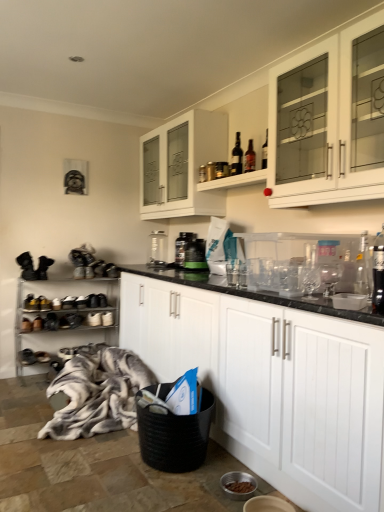
Question: Is dark glass bottle at upper center, the 1th bottle when ordered from left to right, facing away from black suede shoe at lower left?

Choices:
 (A) yes
 (B) no

Answer: (B)

Question: From a real-world perspective, is dark glass bottle at upper center, the 1th bottle when ordered from left to right, physically above black suede shoe at lower left?

Choices:
 (A) no
 (B) yes

Answer: (B)

Question: Is dark glass bottle at upper center, marked as the 2th bottle in a front-to-back arrangement, at the right side of black suede shoe at lower left?

Choices:
 (A) no
 (B) yes

Answer: (B)

Question: Can you confirm if dark glass bottle at upper center, the 1th bottle when ordered from left to right, is shorter than black suede shoe at lower left?

Choices:
 (A) no
 (B) yes

Answer: (A)

Question: From the image's perspective, is dark glass bottle at upper center, the 2th bottle positioned from the right, below black suede shoe at lower left?

Choices:
 (A) no
 (B) yes

Answer: (A)

Question: Could black suede shoe at lower left be considered to be inside dark glass bottle at upper center, acting as the second bottle starting from the bottom?

Choices:
 (A) yes
 (B) no

Answer: (B)

Question: Is metallic silver shoe rack at left, placed as the second shelf when sorted from front to back, facing towards matte glass bottles at upper center, positioned as the second shelf in left-to-right order?

Choices:
 (A) no
 (B) yes

Answer: (A)

Question: From the image's perspective, is metallic silver shoe rack at left, the second shelf from the right, over matte glass bottles at upper center, the first shelf in the top-to-bottom sequence?

Choices:
 (A) yes
 (B) no

Answer: (B)

Question: From a real-world perspective, is metallic silver shoe rack at left, which is the first shelf from bottom to top, physically above matte glass bottles at upper center, positioned as the first shelf in right-to-left order?

Choices:
 (A) no
 (B) yes

Answer: (A)

Question: Would you say metallic silver shoe rack at left, acting as the 2th shelf starting from the top, contains matte glass bottles at upper center, positioned as the second shelf in left-to-right order?

Choices:
 (A) yes
 (B) no

Answer: (B)

Question: Is metallic silver shoe rack at left, placed as the 1th shelf when sorted from left to right, not within matte glass bottles at upper center, which ranks as the second shelf in back-to-front order?

Choices:
 (A) yes
 (B) no

Answer: (A)

Question: Considering the relative sizes of metallic silver shoe rack at left, which is counted as the 1th shelf, starting from the back, and matte glass bottles at upper center, positioned as the 2th shelf in bottom-to-top order, in the image provided, is metallic silver shoe rack at left, which is counted as the 1th shelf, starting from the back, smaller than matte glass bottles at upper center, positioned as the 2th shelf in bottom-to-top order,?

Choices:
 (A) no
 (B) yes

Answer: (A)

Question: Can you confirm if dark glass bottle at upper center, the 2th bottle positioned from the right, is thinner than matte glass bottles at upper center, positioned as the second shelf in left-to-right order?

Choices:
 (A) yes
 (B) no

Answer: (A)